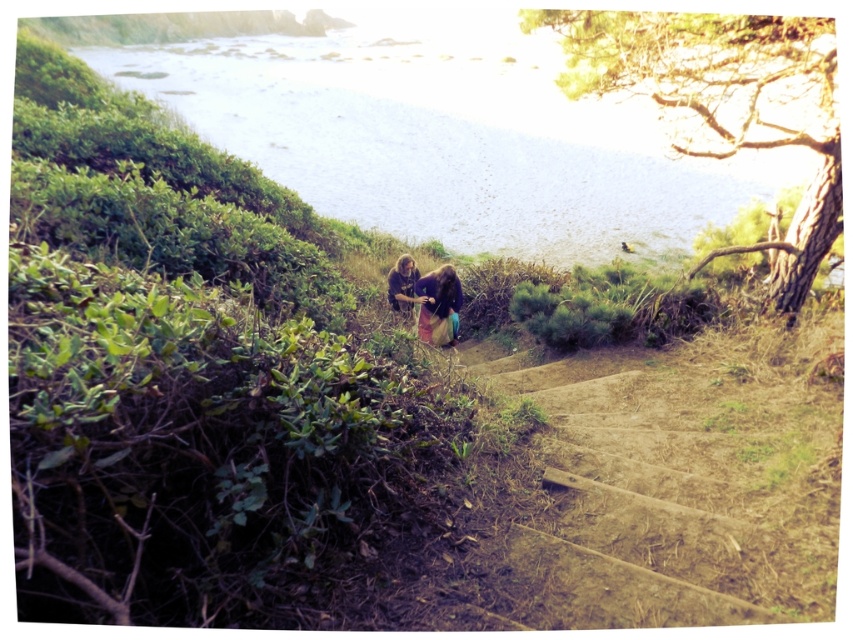
You are a photographer standing on the brown dirt stairs at center and want to capture the dark brown hair at center in your shot. Since the stairs are lower than the hair, will you need to look up or down to frame the subject properly?

The brown dirt stairs at center has a lesser height compared to dark brown hair at center, so you will need to look up to frame the subject properly.

You are standing at the top of the stone steps leading to the beach and see two points marked on the steps. The first point is at coordinates point (630, 627) and the second point is at point (392, 301). Which point is closer to you?

Point (630, 627) is in front of point (392, 301), so it is closer to you.

You are a photographer standing on the brown dirt stairs at center and wearing matte brown pants at center. You want to capture a photo of the steps leading down to the beach. Since your pants are the same color as the stairs, will they blend in with the background when you stand on the stairs?

The brown dirt stairs at center is positioned under matte brown pants at center, so yes, the matte brown pants at center will blend in with the brown dirt stairs at center due to their similar color.